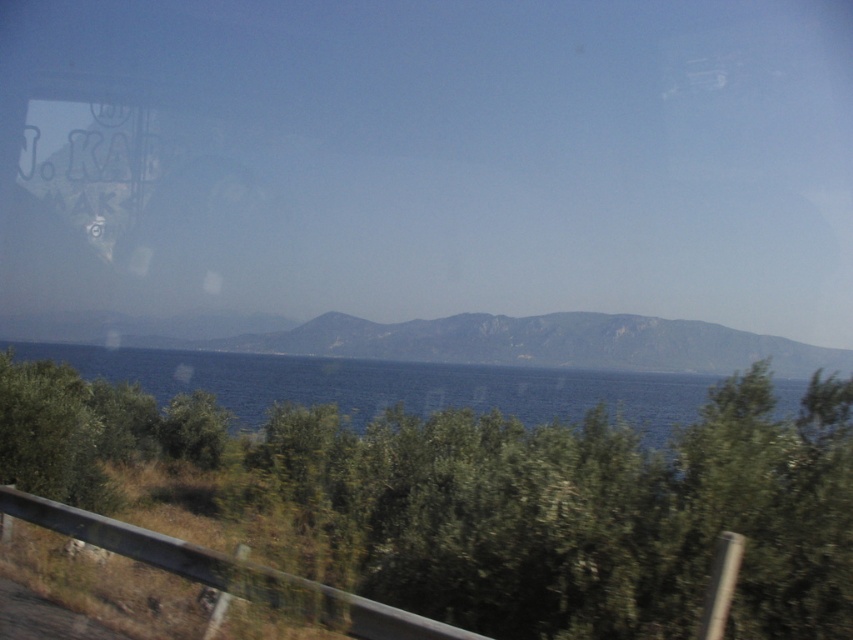
You are a passenger in a car and see the green leafy tree at lower center through the window. The point where you see the tree is marked as point (496, 500). If another passenger points to a spot on the window, how would you describe the location of the green leafy tree at lower center relative to that point?

The green leafy tree at lower center is located at point (496, 500) on the window.

You are a passenger in a car and see two points marked on the window. The first point is at coordinates point (572, 586) and the second is at point (657, 408). Which point is closer to you?

Point (572, 586) is closer to the camera than point (657, 408), so the first point is closer to you.

You are a drone operator who needs to fly a drone from the green rocky mountain at center to the nearest object in the scene. How far will the drone have to travel?

The nearest object to the green rocky mountain at center is the railing in the foreground, which is 431.47 feet away. Therefore, the drone will have to travel 431.47 feet.